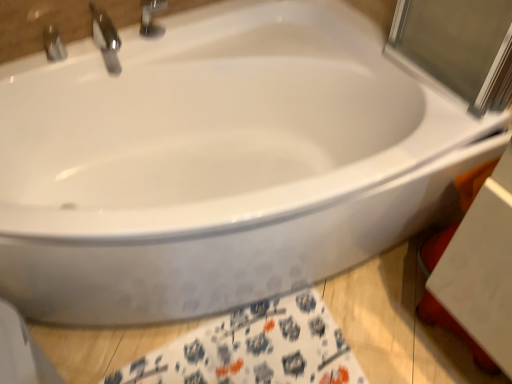
Question: Considering the relative positions of polished chrome faucet at upper left, the 1th tap positioned from the right, and white fabric towel at lower center in the image provided, is polished chrome faucet at upper left, the 1th tap positioned from the right, to the right of white fabric towel at lower center from the viewer's perspective?

Choices:
 (A) no
 (B) yes

Answer: (A)

Question: Is polished chrome faucet at upper left, the 1th tap positioned from the right, wider than white fabric towel at lower center?

Choices:
 (A) no
 (B) yes

Answer: (A)

Question: Considering the relative sizes of polished chrome faucet at upper left, the 1th tap positioned from the right, and white fabric towel at lower center in the image provided, is polished chrome faucet at upper left, the 1th tap positioned from the right, taller than white fabric towel at lower center?

Choices:
 (A) no
 (B) yes

Answer: (B)

Question: From a real-world perspective, does polished chrome faucet at upper left, placed as the second tap when sorted from left to right, stand above white fabric towel at lower center?

Choices:
 (A) no
 (B) yes

Answer: (B)

Question: Is polished chrome faucet at upper left, the 1th tap positioned from the right, closer to the viewer compared to white fabric towel at lower center?

Choices:
 (A) no
 (B) yes

Answer: (A)

Question: Considering the relative positions of white fabric towel at lower center and metallic silver faucet at upper left, which is the second tap from right to left, in the image provided, is white fabric towel at lower center to the left or to the right of metallic silver faucet at upper left, which is the second tap from right to left,?

Choices:
 (A) right
 (B) left

Answer: (A)

Question: From their relative heights in the image, would you say white fabric towel at lower center is taller or shorter than metallic silver faucet at upper left, the first tap positioned from the left?

Choices:
 (A) short
 (B) tall

Answer: (A)

Question: Is white fabric towel at lower center situated inside metallic silver faucet at upper left, which is the second tap from right to left, or outside?

Choices:
 (A) inside
 (B) outside

Answer: (B)

Question: From the image's perspective, is white fabric towel at lower center above or below metallic silver faucet at upper left, the first tap positioned from the left?

Choices:
 (A) below
 (B) above

Answer: (A)

Question: Choose the correct answer: Is polished chrome faucet at upper left, placed as the second tap when sorted from left to right, inside metallic silver faucet at upper left, which is the second tap from right to left, or outside it?

Choices:
 (A) outside
 (B) inside

Answer: (A)

Question: Is polished chrome faucet at upper left, placed as the second tap when sorted from left to right, wider or thinner than metallic silver faucet at upper left, the first tap positioned from the left?

Choices:
 (A) thin
 (B) wide

Answer: (B)

Question: From the image's perspective, relative to metallic silver faucet at upper left, the first tap positioned from the left, is polished chrome faucet at upper left, placed as the second tap when sorted from left to right, above or below?

Choices:
 (A) above
 (B) below

Answer: (A)

Question: Does point (91, 0) appear closer or farther from the camera than point (54, 26)?

Choices:
 (A) farther
 (B) closer

Answer: (A)

Question: From the image's perspective, is metallic silver faucet at upper left, which is the second tap from right to left, located above or below white fabric towel at lower center?

Choices:
 (A) below
 (B) above

Answer: (B)

Question: From a real-world perspective, is metallic silver faucet at upper left, which is the second tap from right to left, positioned above or below white fabric towel at lower center?

Choices:
 (A) above
 (B) below

Answer: (A)